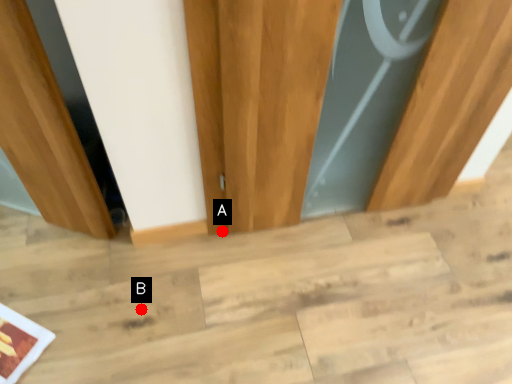
Question: Two points are circled on the image, labeled by A and B beside each circle. Among these points, which one is farthest from the camera?

Choices:
 (A) A is further
 (B) B is further

Answer: (A)